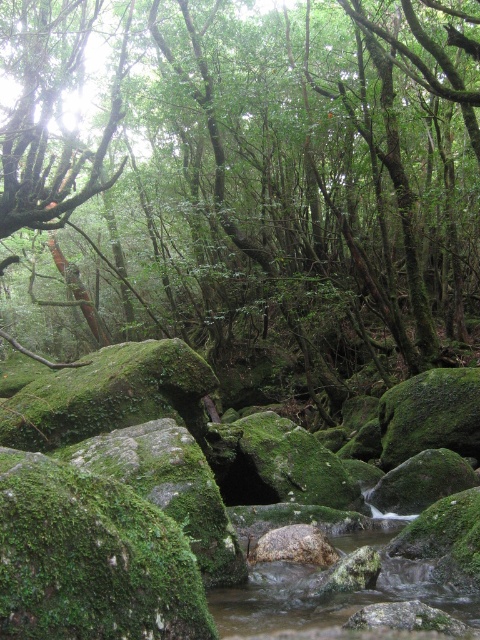
Question: Is green mossy rock at center below clear water at stream center?

Choices:
 (A) yes
 (B) no

Answer: (B)

Question: Which point is farther to the camera?

Choices:
 (A) (231, 611)
 (B) (170, 97)

Answer: (B)

Question: Observing the image, what is the correct spatial positioning of green mossy rock at center in reference to clear water at stream center?

Choices:
 (A) left
 (B) right

Answer: (A)

Question: Can you confirm if green mossy rock at center is positioned below clear water at stream center?

Choices:
 (A) no
 (B) yes

Answer: (A)

Question: Which point appears closest to the camera in this image?

Choices:
 (A) (259, 572)
 (B) (432, 24)

Answer: (A)